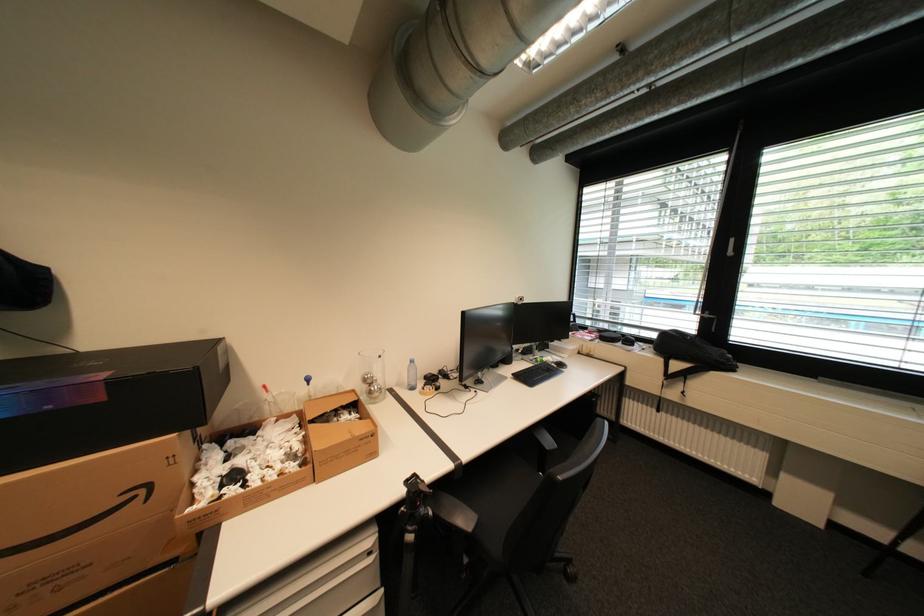
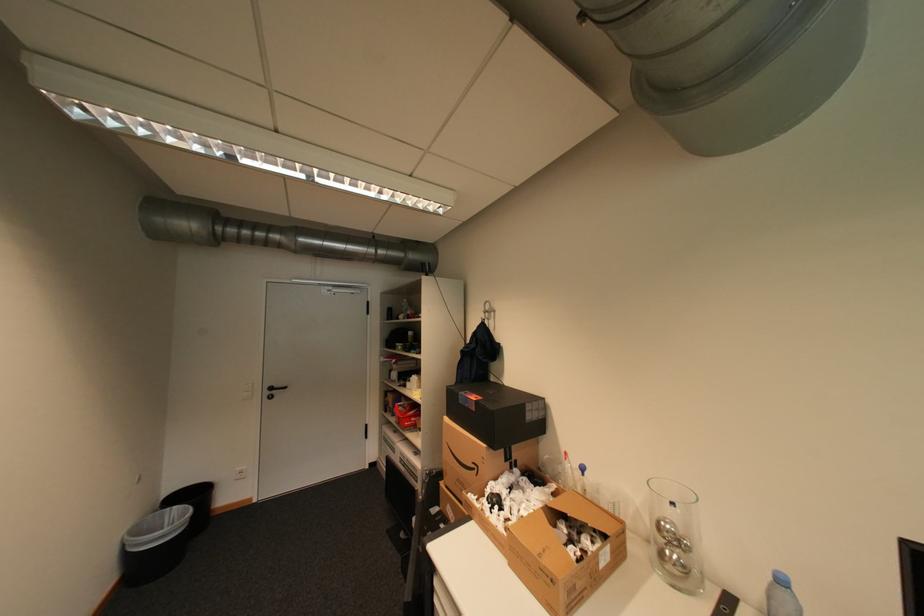
Question: How did the camera likely rotate?

Choices:
 (A) Left
 (B) Right
 (C) Up
 (D) Down

Answer: (A)